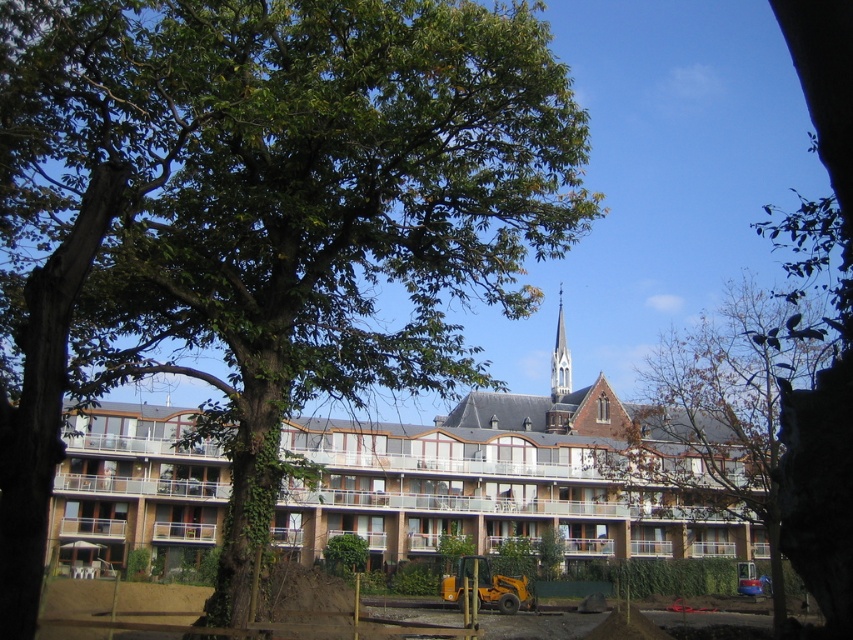
You are an architect reviewing a site plan and need to determine the exact position of the green leafy tree at center. According to the coordinates provided, what are its 2D coordinates?

The 2D coordinates of the green leafy tree at center are at point (259,218).

You are a drone operator tasked with capturing aerial footage of the green leafy tree at center and the smooth white steeple at upper center. Based on the scene, will the tree block the view of the steeple when flying directly above them?

The green leafy tree at center is in front of the smooth white steeple at upper center, so flying directly above them would result in the tree blocking the view of the steeple.

You are a city planner analyzing the image. Based on the scene, which object occupies more space in the foreground between the brown brick building at center and the brown leafy tree at center?

The brown brick building at center has a larger size compared to the brown leafy tree at center, so it occupies more space in the foreground.